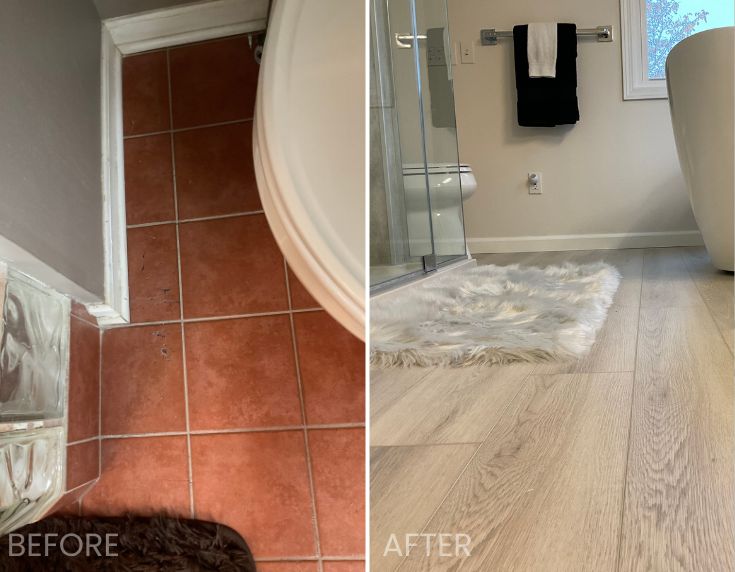
Find the location of `towel`. towel is located at coordinates (545, 53), (544, 92).